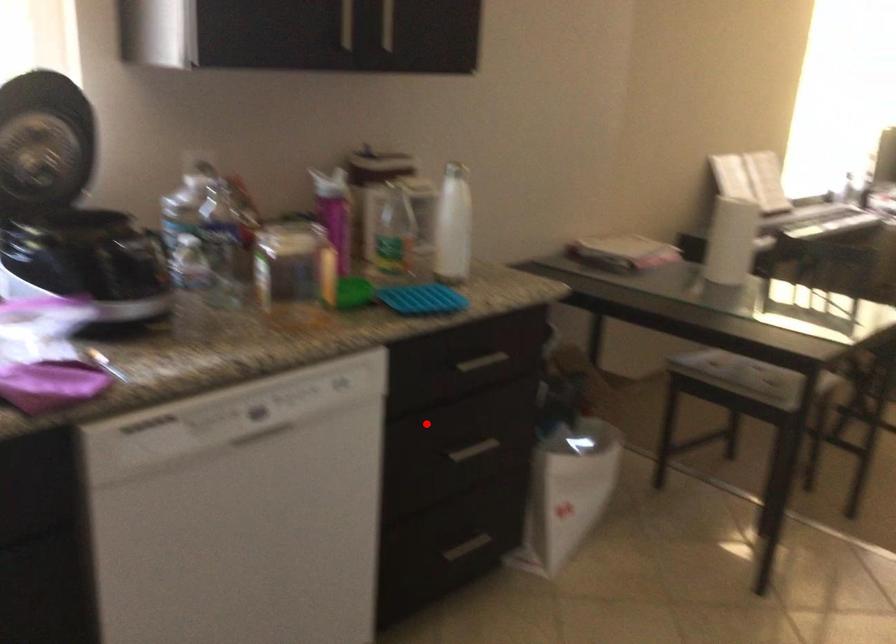
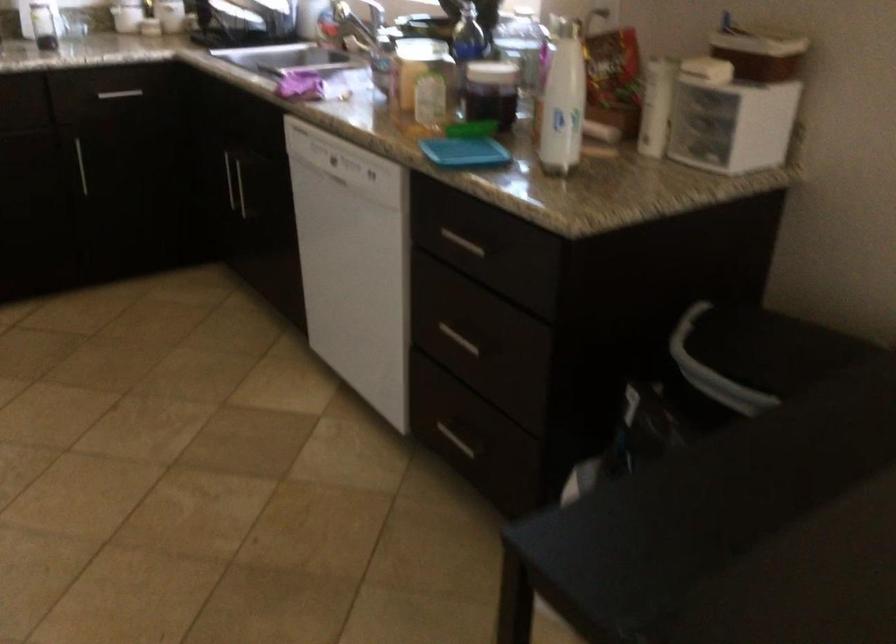
Locate, in the second image, the point that corresponds to the highlighted location in the first image.

(459, 339)